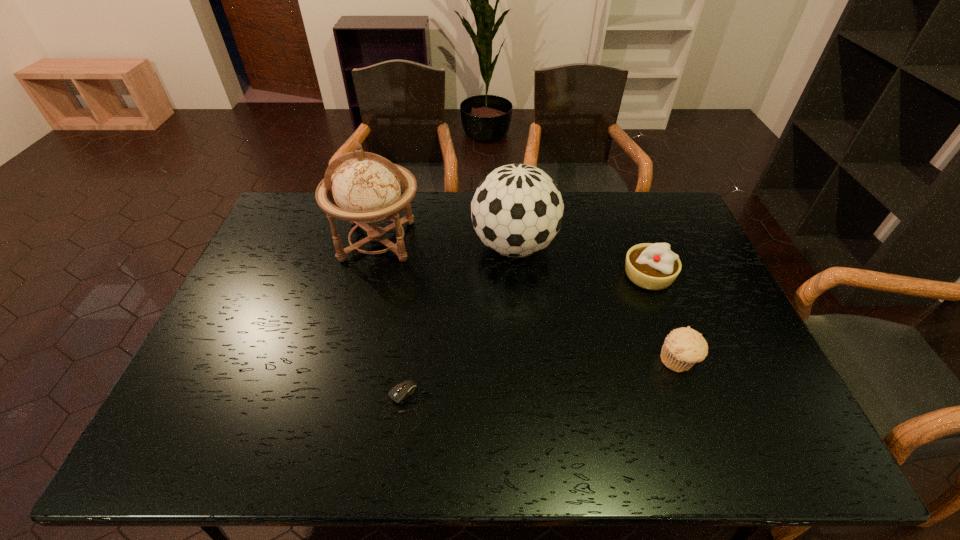
Locate an element on the screen. This screenshot has width=960, height=540. vacant area in the image that satisfies the following two spatial constraints: 1. on the front side of the third tallest object; 2. on the left side of the third object from left to right is located at coordinates (516, 276).